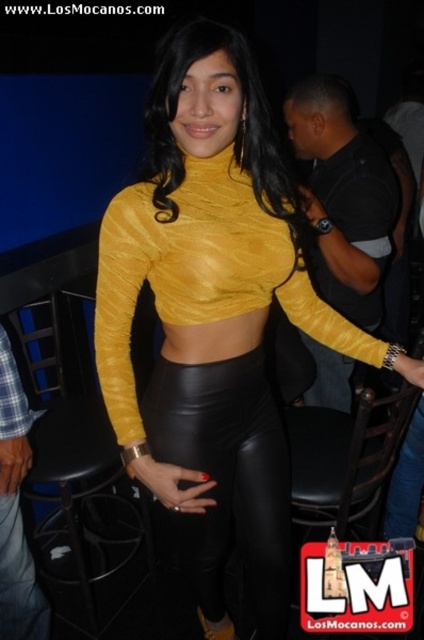
You are a photographer trying to capture the black leather skirt at center and the black leather bar stool at lower center in the same frame. Which object should you focus on first if you want to ensure both are in focus without moving the camera?

The black leather skirt at center is bigger than the black leather bar stool at lower center, so focusing on the black leather skirt at center first will help ensure both are in focus since it is larger and closer to the camera.